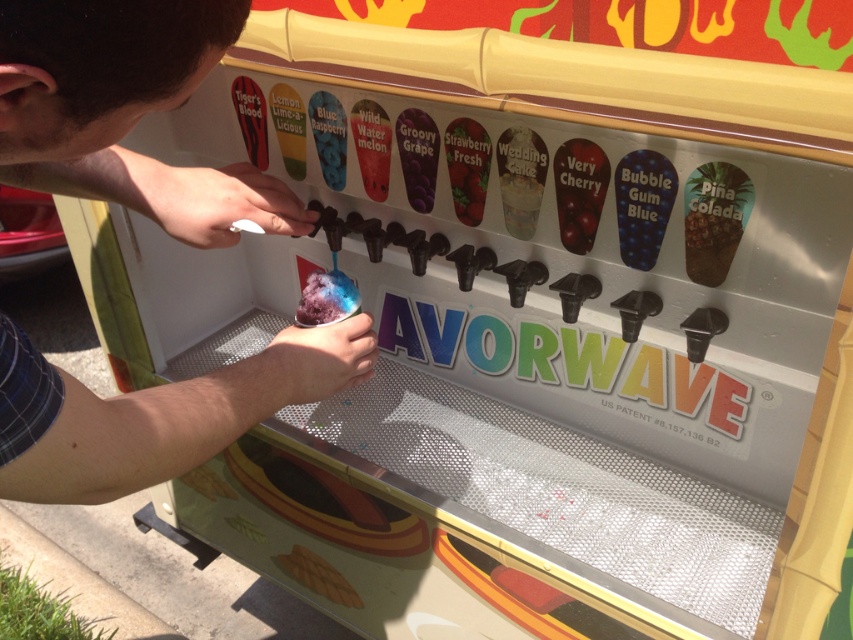
You are at the AVORWAVE shaved ice machine and want to get a drink. You notice a matte black cup at center and a gelatinous blue ice cream at center. Which object is directly above the other?

The matte black cup at center is positioned over the gelatinous blue ice cream at center, so the matte black cup is directly above it.

You are standing in front of the AVORWAVE shaved ice machine and notice two points marked on the machine. The first point is at coordinate (213, 230) and the second is at (506, 144). Which point is closer to you?

A: Point (213, 230) is closer to you than point (506, 144).